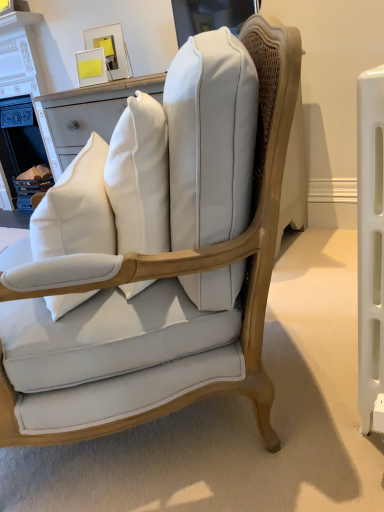
Question: Considering the relative sizes of white cotton throw pillow at center and white painted wood fireplace at upper left in the image provided, is white cotton throw pillow at center wider than white painted wood fireplace at upper left?

Choices:
 (A) yes
 (B) no

Answer: (B)

Question: From the image's perspective, is white cotton throw pillow at center below white painted wood fireplace at upper left?

Choices:
 (A) no
 (B) yes

Answer: (B)

Question: Does white cotton throw pillow at center have a lesser width compared to white painted wood fireplace at upper left?

Choices:
 (A) no
 (B) yes

Answer: (B)

Question: Is white cotton throw pillow at center to the right of white painted wood fireplace at upper left from the viewer's perspective?

Choices:
 (A) yes
 (B) no

Answer: (A)

Question: Is white cotton throw pillow at center in contact with white painted wood fireplace at upper left?

Choices:
 (A) no
 (B) yes

Answer: (A)

Question: Can we say white cotton throw pillow at center lies outside white painted wood fireplace at upper left?

Choices:
 (A) yes
 (B) no

Answer: (A)

Question: Considering the relative sizes of matte white cushioned chair at center and white painted wood fireplace at upper left in the image provided, is matte white cushioned chair at center shorter than white painted wood fireplace at upper left?

Choices:
 (A) yes
 (B) no

Answer: (A)

Question: Can you confirm if matte white cushioned chair at center is positioned to the right of white painted wood fireplace at upper left?

Choices:
 (A) no
 (B) yes

Answer: (B)

Question: Is matte white cushioned chair at center not inside white painted wood fireplace at upper left?

Choices:
 (A) no
 (B) yes

Answer: (B)

Question: Can you confirm if matte white cushioned chair at center is smaller than white painted wood fireplace at upper left?

Choices:
 (A) yes
 (B) no

Answer: (B)

Question: Does matte white cushioned chair at center come in front of white painted wood fireplace at upper left?

Choices:
 (A) yes
 (B) no

Answer: (A)

Question: Is matte white cushioned chair at center directly adjacent to white painted wood fireplace at upper left?

Choices:
 (A) no
 (B) yes

Answer: (A)

Question: Considering the relative positions of matte white cushioned chair at center and white cotton throw pillow at center in the image provided, is matte white cushioned chair at center to the right of white cotton throw pillow at center from the viewer's perspective?

Choices:
 (A) yes
 (B) no

Answer: (A)